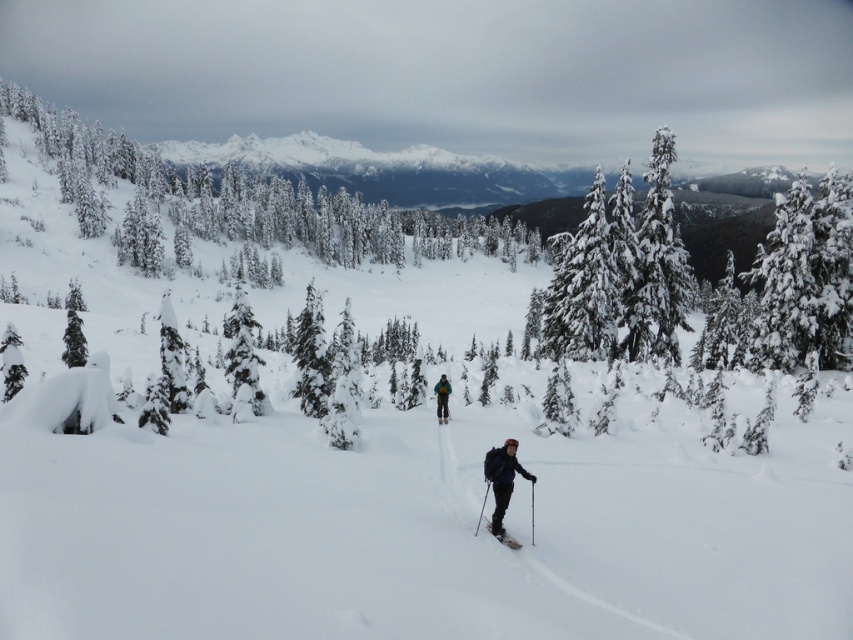
You are planning to take a photo of the dark blue jacket at center and the green textured tree at upper right. Which object should you focus on first if you want to capture both in the same frame without moving the camera?

The green textured tree at upper right is taller than the dark blue jacket at center, so you should focus on the green textured tree at upper right first to ensure both are in the frame.